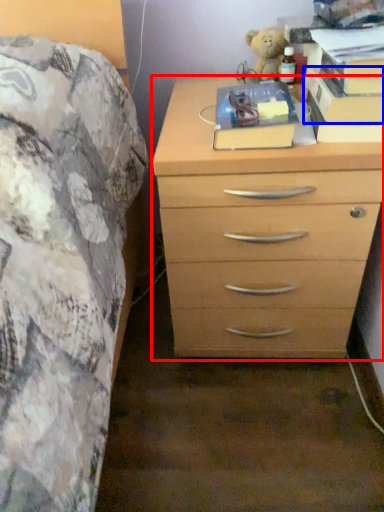
Question: Which object is closer to the camera taking this photo, chest of drawers (highlighted by a red box) or paperback book (highlighted by a blue box)?

Choices:
 (A) chest of drawers
 (B) paperback book

Answer: (A)